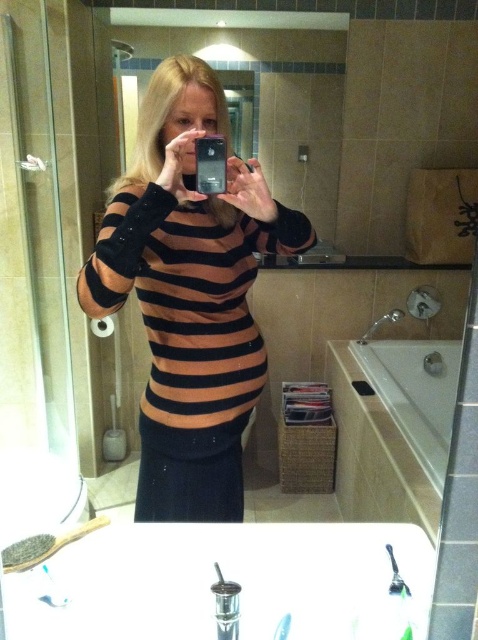
Who is shorter, black striped sweater at center or white glossy bathtub at lower right?

white glossy bathtub at lower right is shorter.

Can you confirm if black striped sweater at center is taller than white glossy bathtub at lower right?

Correct, black striped sweater at center is much taller as white glossy bathtub at lower right.

Where is `black striped sweater at center`? This screenshot has width=478, height=640. black striped sweater at center is located at coordinates (189, 294).

Where is `black striped sweater at center`? The width and height of the screenshot is (478, 640). black striped sweater at center is located at coordinates (189, 294).